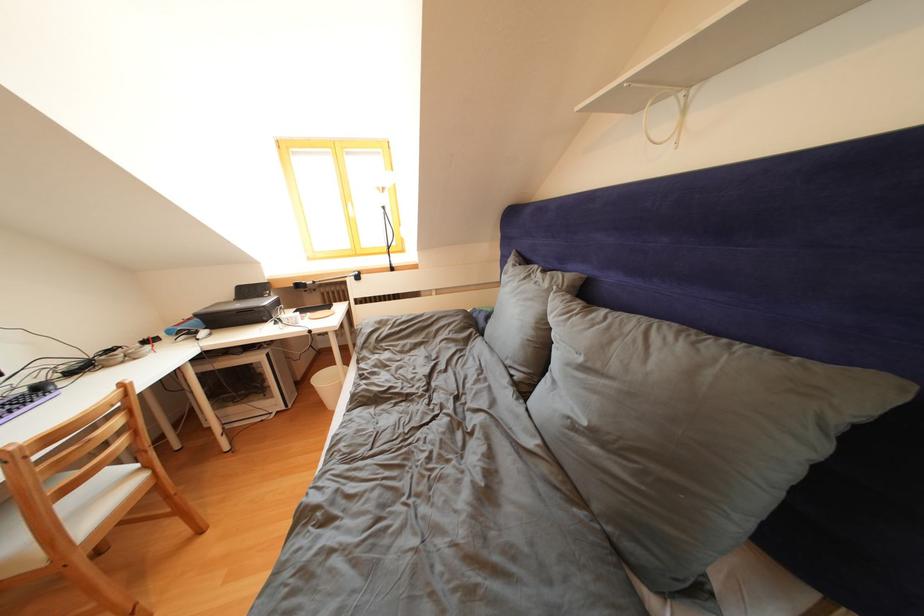
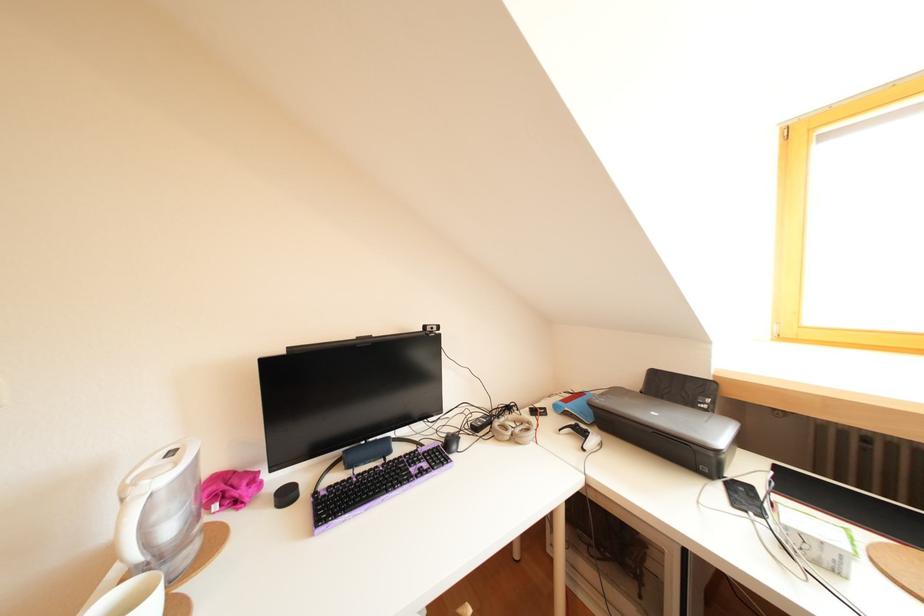
Where in the second image is the point corresponding to (x=118, y=357) from the first image?

(516, 413)